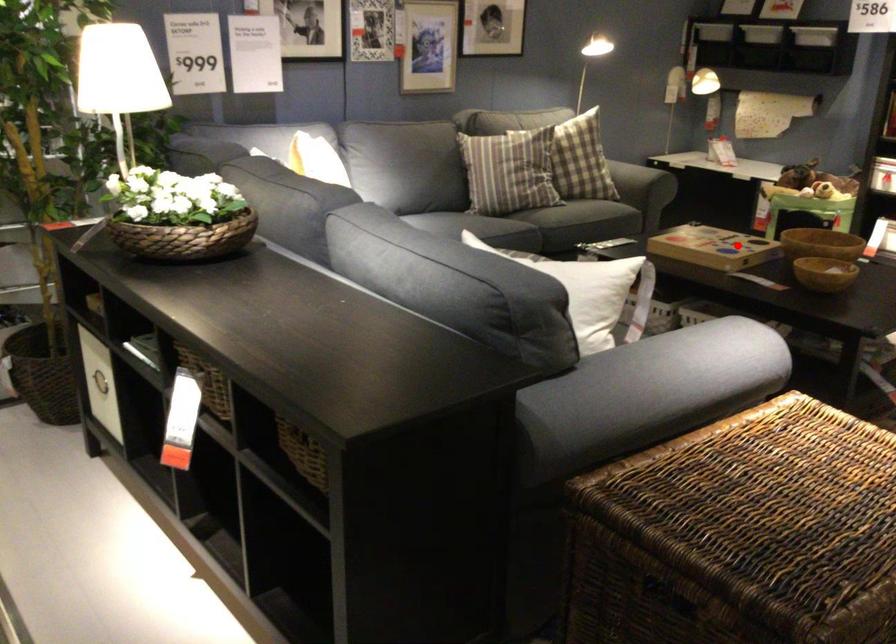
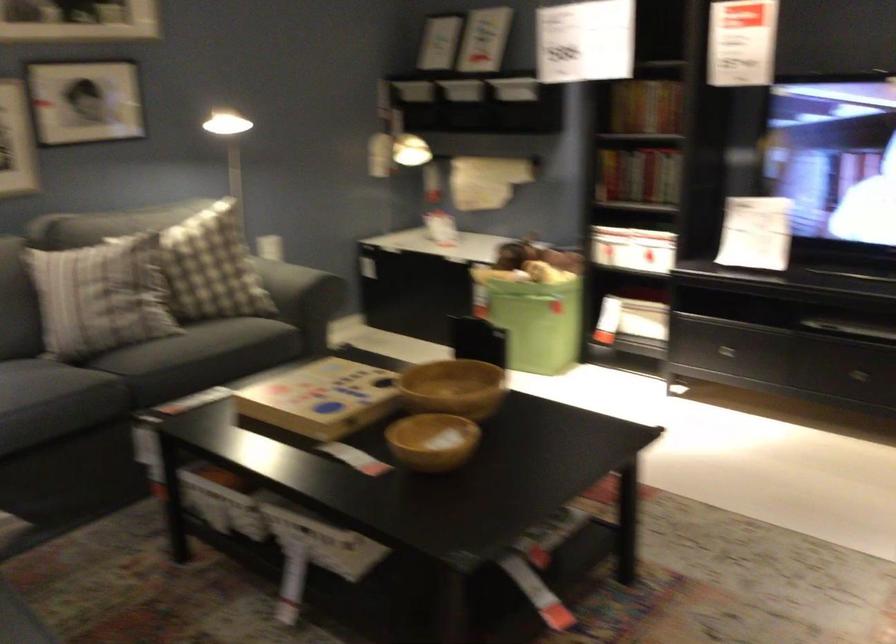
Question: I am providing you with two images of the same scene from different viewpoints. A red point is marked on the first image. Can you still see the location of the red point in image 2?

Choices:
 (A) Yes
 (B) No

Answer: (A)